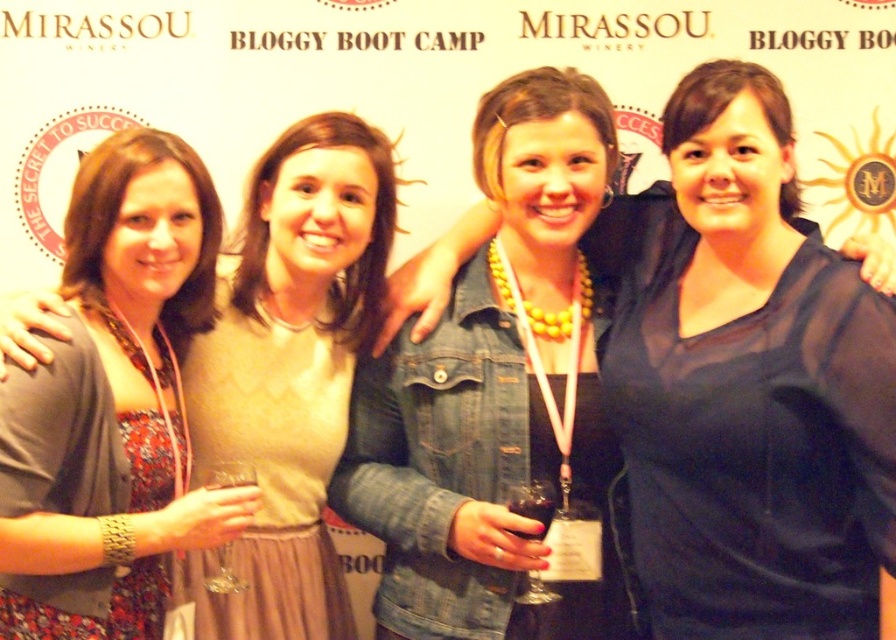
You are a photographer at the MIRASSOU WINERY promotional event. You want to capture a shot where the denim jacket at center and the translucent glass wine at center are both visible. Since the denim jacket is covering part of the wine glass, how can you adjust the subjects to ensure the wine glass is fully visible without moving the denim jacket?

The denim jacket at center is positioned over the translucent glass wine at center. To ensure the wine glass is fully visible without moving the jacket, you could tilt the jacket slightly upward or backward so that it no longer obscures the glass, or adjust the angle of the camera to capture the glass from a vantage point where the jacket is not blocking it.

You are a photographer at the MIRASSOU WINERY event. You need to place a 15cm wide decorative item between the denim jacket at center and the translucent glass wine at center. Can you fit it there?

The denim jacket at center is narrower than the translucent glass wine at center. The space between them may vary, but since the jacket is narrower, there might be enough space. However, without knowing the exact distance between them, it is uncertain if the 15cm item will fit. Additional measurements are needed.